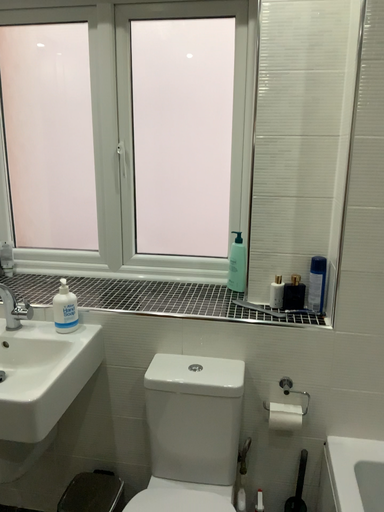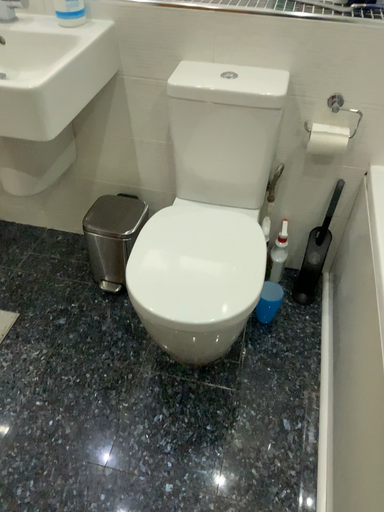
Question: Which way did the camera rotate in the video?

Choices:
 (A) rotated downward
 (B) rotated upward

Answer: (A)